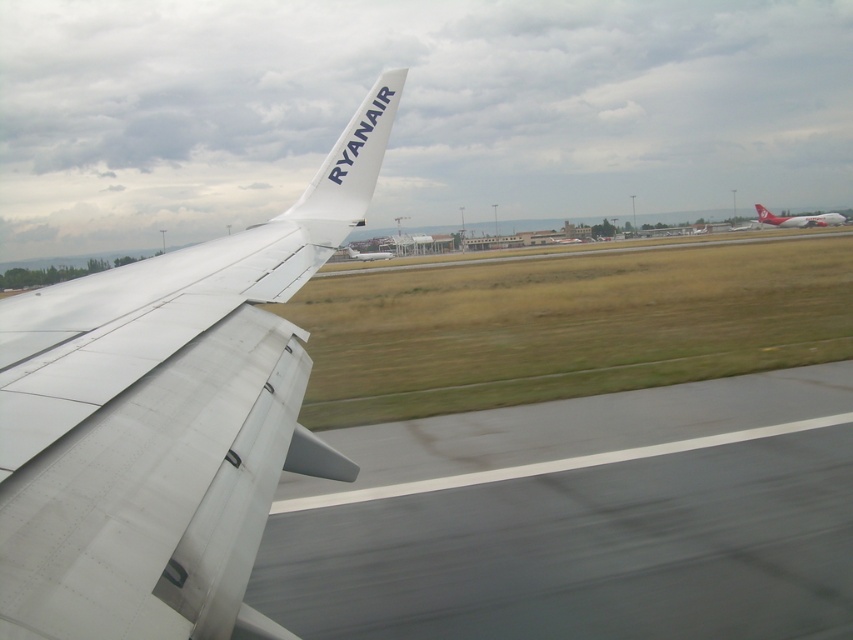
Looking at this image, is gray asphalt runway at lower center below white glossy airplane at right?

Yes, gray asphalt runway at lower center is below white glossy airplane at right.

Can you confirm if gray asphalt runway at lower center is taller than white glossy airplane at right?

Incorrect, gray asphalt runway at lower center's height is not larger of white glossy airplane at right's.

Which is in front, point (361, 604) or point (778, 216)?

Point (361, 604)

Where is `gray asphalt runway at lower center`? The image size is (853, 640). gray asphalt runway at lower center is located at coordinates (581, 518).

Between white matte airplane wing at left and white matte airplane at center, which one appears on the left side from the viewer's perspective?

Positioned to the left is white matte airplane at center.

Looking at this image, who is positioned more to the right, white matte airplane wing at left or white matte airplane at center?

From the viewer's perspective, white matte airplane wing at left appears more on the right side.

This screenshot has width=853, height=640. I want to click on white matte airplane wing at left, so (x=166, y=419).

Where is `white matte airplane wing at left`? white matte airplane wing at left is located at coordinates (166, 419).

In the scene shown: Between white matte airplane wing at left and white matte ryanair tail at upper center, which one has less height?

Result: Standing shorter between the two is white matte ryanair tail at upper center.

Is white matte airplane wing at left taller than white matte ryanair tail at upper center?

Yes, white matte airplane wing at left is taller than white matte ryanair tail at upper center.

Identify the location of white matte airplane wing at left. The height and width of the screenshot is (640, 853). (166, 419).

Find the location of a particular element. Image resolution: width=853 pixels, height=640 pixels. white matte airplane wing at left is located at coordinates (166, 419).